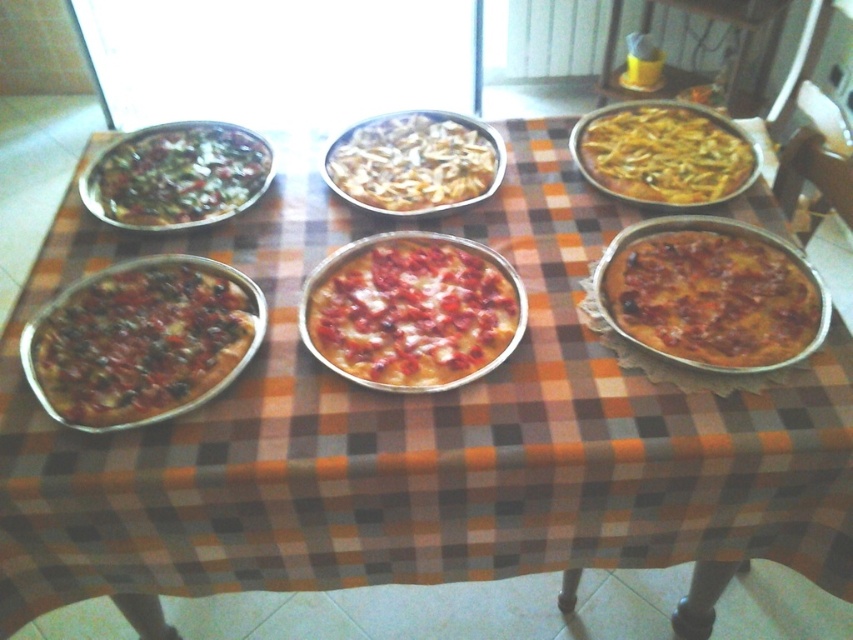
What is the location of the golden brown crusty pizza at center right on the table?

The golden brown crusty pizza at center right is located at point [712,298] on the table.

You are a food delivery person who needs to place a pizza box that is 15 inches wide on the table. The box must be placed between the golden brown crusty pizza at center right and the cheesy white pizza at center. Will the box fit between them?

The golden brown crusty pizza at center right is 14.97 inches away from the cheesy white pizza at center. Since the distance between them is slightly less than 15 inches, the pizza box will not fit between them.